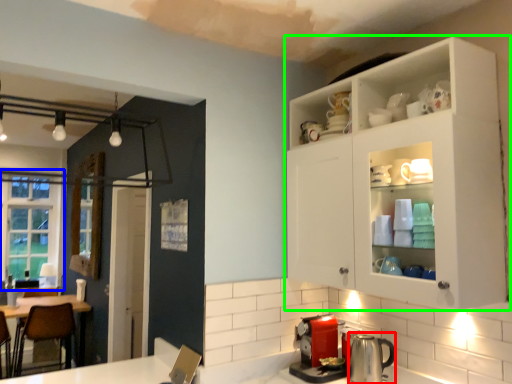
Question: Which object is positioned farthest from appliance (highlighted by a red box)? Select from window (highlighted by a blue box) and cabinetry (highlighted by a green box).

Choices:
 (A) window
 (B) cabinetry

Answer: (A)